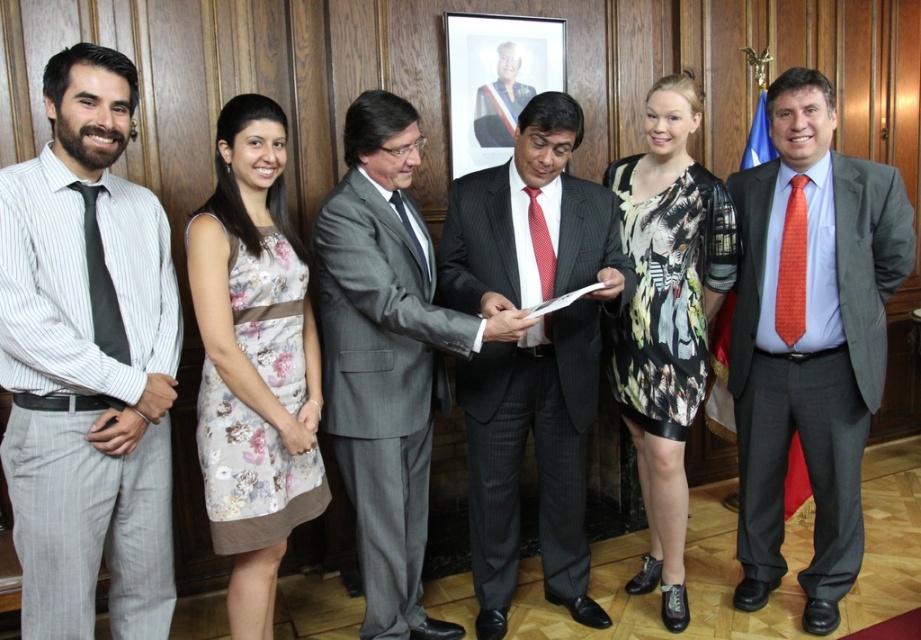
Does floral print dress at center have a lesser height compared to white paper at center?

In fact, floral print dress at center may be taller than white paper at center.

Does point (651, 547) come farther from viewer compared to point (491, 340)?

Yes.

Find the location of a particular element. The image size is (921, 640). floral print dress at center is located at coordinates (667, 317).

Which is in front, point (101, 304) or point (552, 276)?

Positioned in front is point (101, 304).

The width and height of the screenshot is (921, 640). I want to click on matte black tie at left, so click(x=101, y=284).

Find the location of a particular element. This screenshot has height=640, width=921. matte black tie at left is located at coordinates (101, 284).

Which is more to the right, floral fabric dress at center or red dotted tie at center?

red dotted tie at center

Is floral fabric dress at center positioned in front of red dotted tie at center?

Yes, floral fabric dress at center is closer to the viewer.

Describe the element at coordinates (254, 360) in the screenshot. The height and width of the screenshot is (640, 921). I see `floral fabric dress at center` at that location.

The width and height of the screenshot is (921, 640). I want to click on floral fabric dress at center, so click(254, 360).